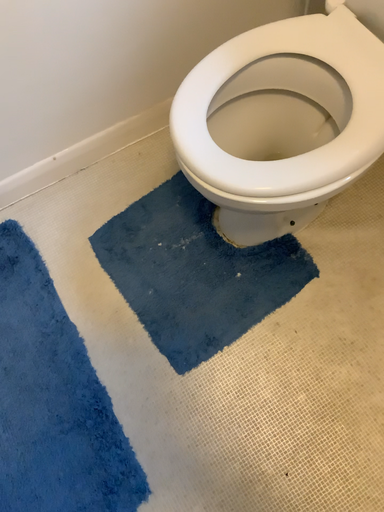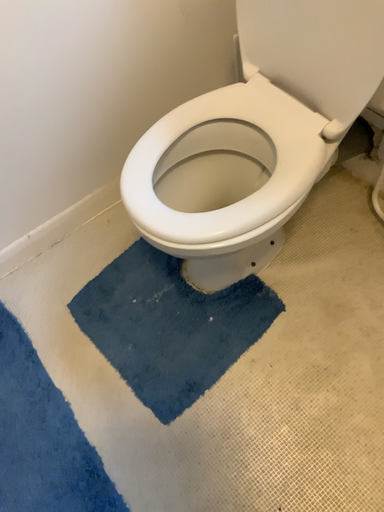
Question: Which way did the camera rotate in the video?

Choices:
 (A) rotated downward
 (B) rotated upward

Answer: (B)